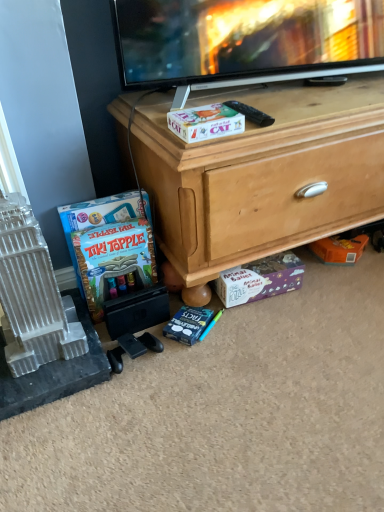
Locate an element on the screen. free space in front of purple cardboard puzzle box at lower center is located at coordinates (262, 330).